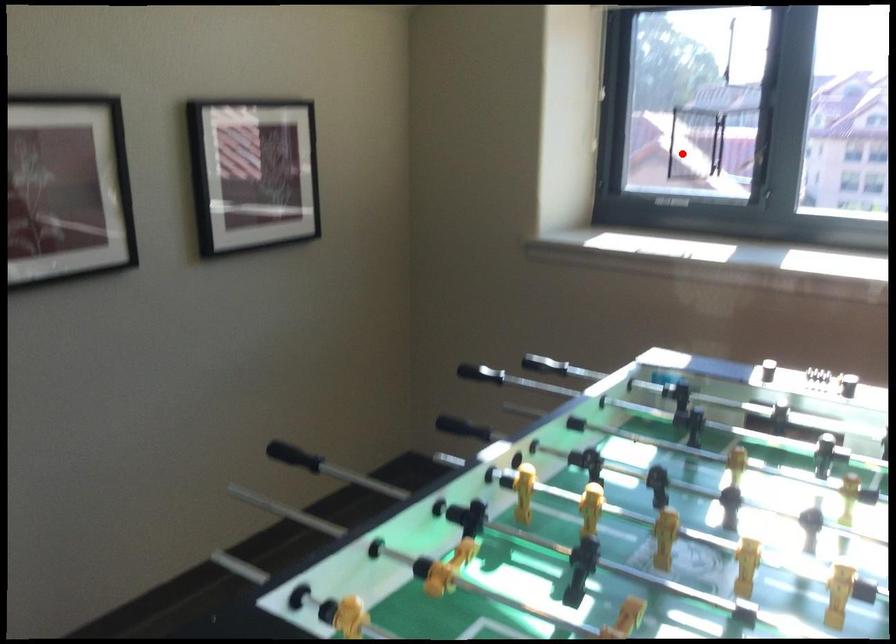
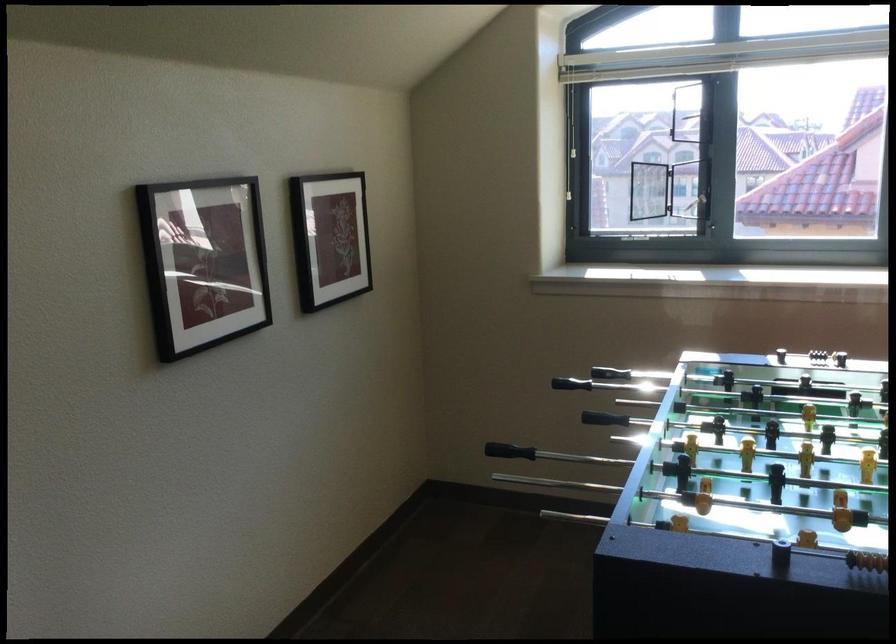
Where in the second image is the point corresponding to the highlighted location from the first image?

(648, 190)